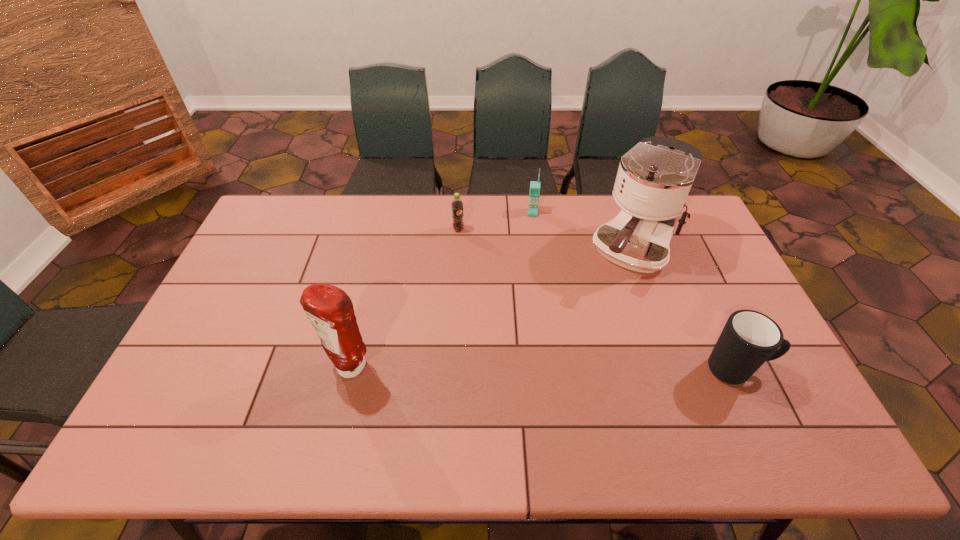
You are a GUI agent. You are given a task and a screenshot of the screen. Output one action in this format:
    pyautogui.click(x=<x>, y=<y>)
    Task: Click on the vacant space at the near right corner
    
    Given the screenshot: What is the action you would take?
    pyautogui.click(x=764, y=395)

Find the location of a particular element. This screenshot has height=540, width=960. vacant point located between the leftmost object and the second object from left to right is located at coordinates (404, 300).

Image resolution: width=960 pixels, height=540 pixels. I want to click on vacant space in between the tallest object and the soda, so pos(545,241).

Locate an element on the screen. Image resolution: width=960 pixels, height=540 pixels. free area in between the cellular telephone and the mug is located at coordinates (635, 291).

Find the location of a particular element. free point between the mug and the tallest object is located at coordinates click(x=685, y=311).

Where is `vacant area that lies between the third object from right to left and the mug`? vacant area that lies between the third object from right to left and the mug is located at coordinates (635, 291).

In order to click on free spot between the third object from right to left and the fourth shortest object in this screenshot , I will do `click(441, 291)`.

Where is `vacant point located between the cellular telephone and the tallest object`? The height and width of the screenshot is (540, 960). vacant point located between the cellular telephone and the tallest object is located at coordinates (583, 232).

Locate an element on the screen. The height and width of the screenshot is (540, 960). free space between the mug and the leftmost object is located at coordinates (543, 369).

Find the location of a particular element. This screenshot has height=540, width=960. free space between the condiment and the second object from left to right is located at coordinates (404, 300).